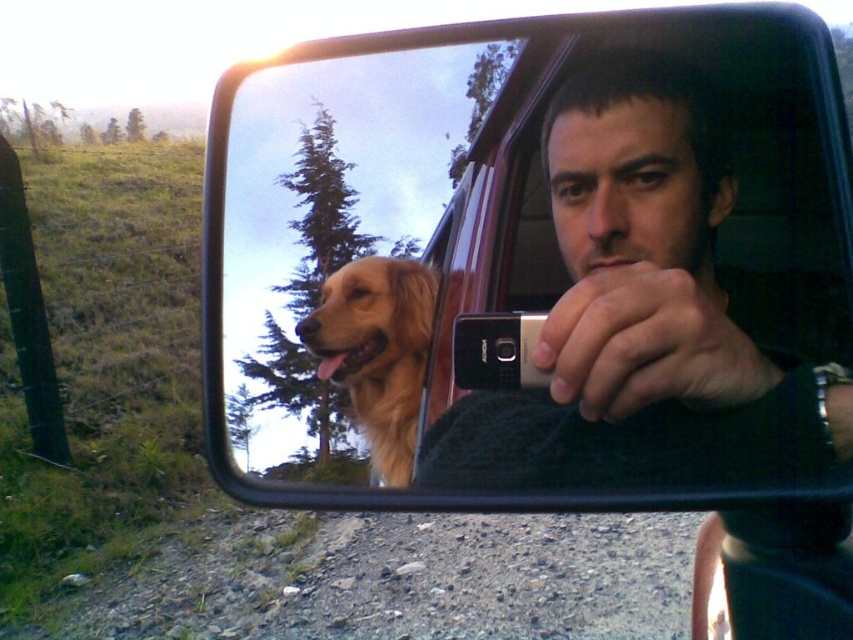
You are a delivery robot with a 10 inch wide package. You need to place the package between the matte black phone at center and the golden fur dog at upper left in the car mirror reflection. Can the package fit in the space between them?

The distance between the matte black phone at center and the golden fur dog at upper left is 7.77 inches. Since the package is 10 inches wide, it cannot fit in the space between them as the distance is smaller than the package width.

You are a passenger in the car and want to take a photo of the golden fur dog at upper left using the matte black phone at center. Can you do this without moving either object?

The matte black phone at center is located below the golden fur dog at upper left, so yes, you can take the photo as the phone is positioned below the dog and within reach.